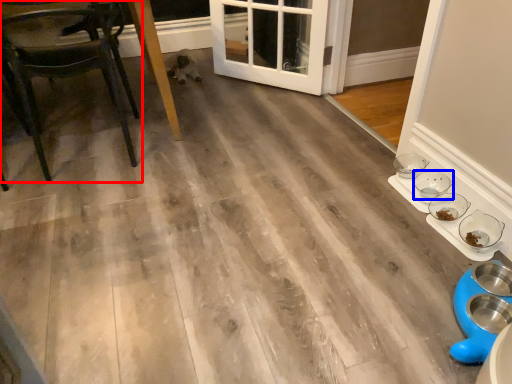
Question: Which point is closer to the camera, chair (highlighted by a red box) or bowl (highlighted by a blue box)?

Choices:
 (A) chair
 (B) bowl

Answer: (A)